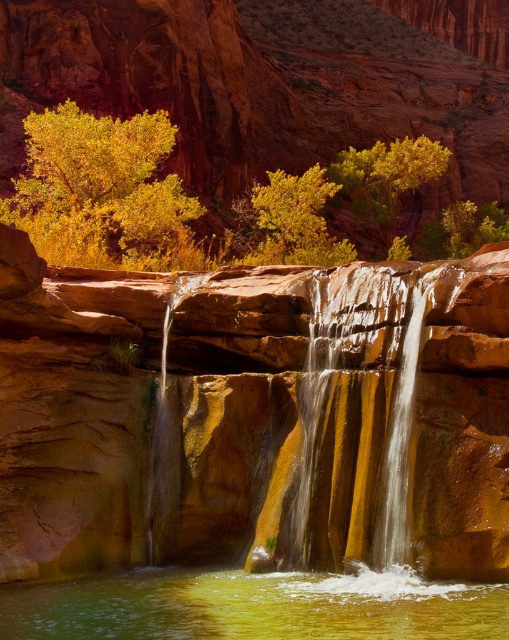
Is point (86, 582) positioned in front of point (397, 460)?

No, it is behind (397, 460).

Find the location of `green translucent water at lower center`. green translucent water at lower center is located at coordinates (253, 605).

The height and width of the screenshot is (640, 509). What do you see at coordinates (253, 605) in the screenshot?
I see `green translucent water at lower center` at bounding box center [253, 605].

Where is `green translucent water at lower center`? The height and width of the screenshot is (640, 509). green translucent water at lower center is located at coordinates (253, 605).

Between point (3, 592) and point (269, 224), which one is positioned behind?

The point (269, 224) is more distant.

Is point (417, 579) farther from viewer compared to point (281, 211)?

No, (417, 579) is closer to viewer.

This screenshot has width=509, height=640. I want to click on green translucent water at lower center, so click(253, 605).

Between green translucent water at lower center and smooth golden rock at center, which one is positioned lower?

green translucent water at lower center is below.

Does point (456, 592) come farther from viewer compared to point (364, 276)?

No, (456, 592) is in front of (364, 276).

The image size is (509, 640). Find the location of `green translucent water at lower center`. green translucent water at lower center is located at coordinates (253, 605).